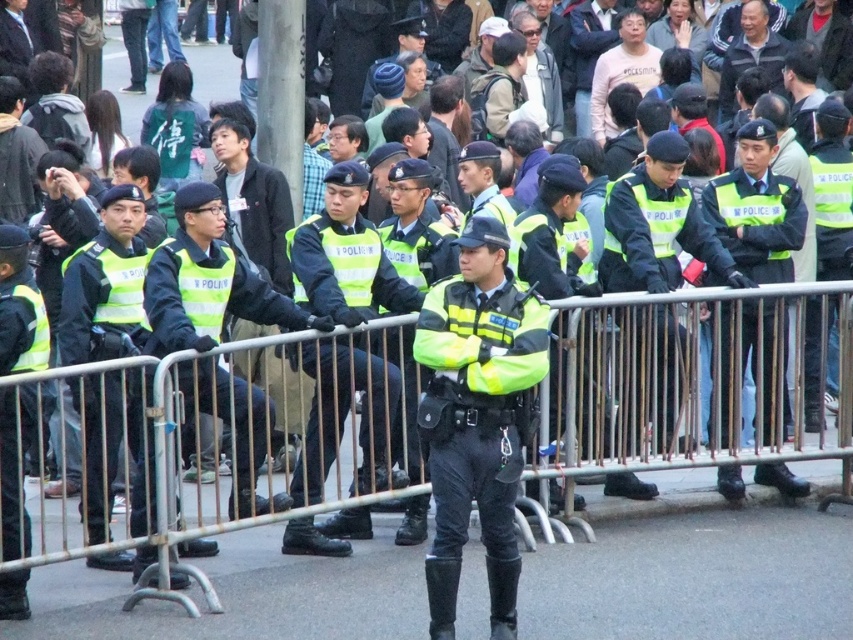
You are a drone operator tasked with capturing aerial footage of the crowd. You notice a metallic silver rail at center located at point [659,394]. If you position your drone directly above this point, will it be hovering over the crowd or the police officers?

The metallic silver rail at center is located at point [659,394]. Since the rail is part of the barricade where police officers are stationed, positioning the drone directly above this point would place it over the police officers rather than the crowd.

You are a photographer trying to capture a clear shot of the reflective green vest at center. You notice the metallic silver rail at center is blocking part of the vest. Can you determine if the rail is wider than the vest?

The metallic silver rail at center is wider than the reflective green vest at center, so it is blocking part of the vest.